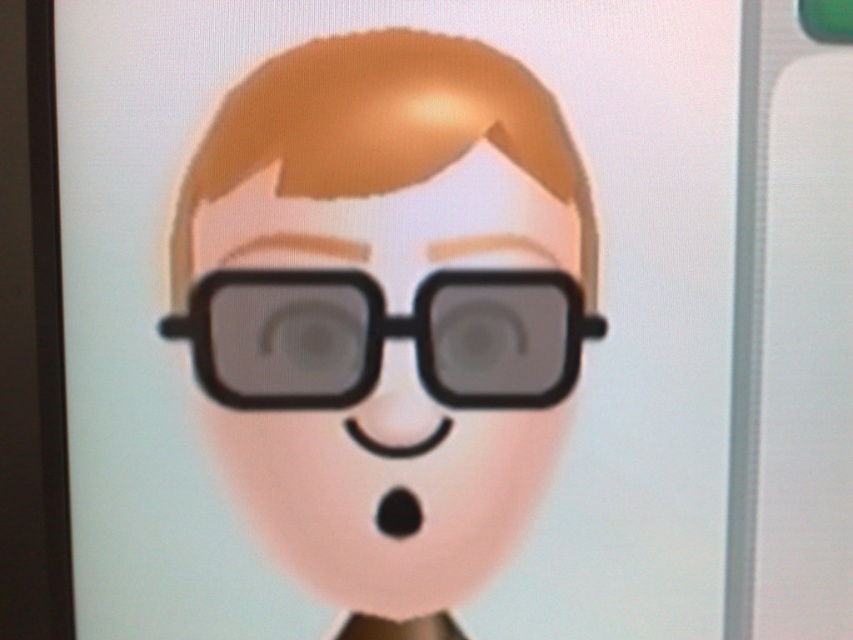
You are an AI assistant analyzing the position of objects in an image. The scene shows a character with glasses on a plain background. There is a point marked at coordinates point (x=389, y=490). Which object in the scene is located at this point?

The matte black glasses at center is represented by point (x=389, y=490).

You are designing a frame for the glasses in the image. The frame must accommodate both the matte black glasses at center and the black matte glasses at center. Which pair requires a wider frame?

The black matte glasses at center requires a wider frame because its width is greater than the matte black glasses at center.

You are looking at the screen showing the character. There are two objects labeled matte black glasses at center and black matte glasses at center. Which one is positioned to the right?

The matte black glasses at center is positioned to the right of the black matte glasses at center.